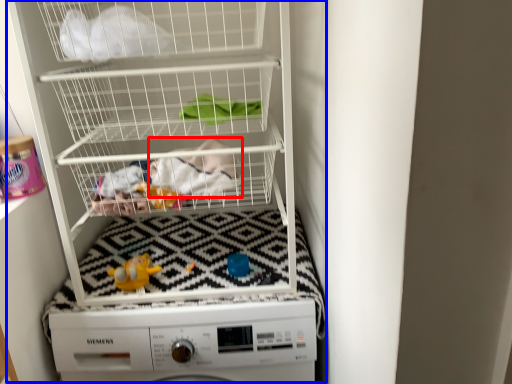
Question: Which object appears closest to the camera in this image, clothing (highlighted by a red box) or bunk bed (highlighted by a blue box)?

Choices:
 (A) clothing
 (B) bunk bed

Answer: (B)